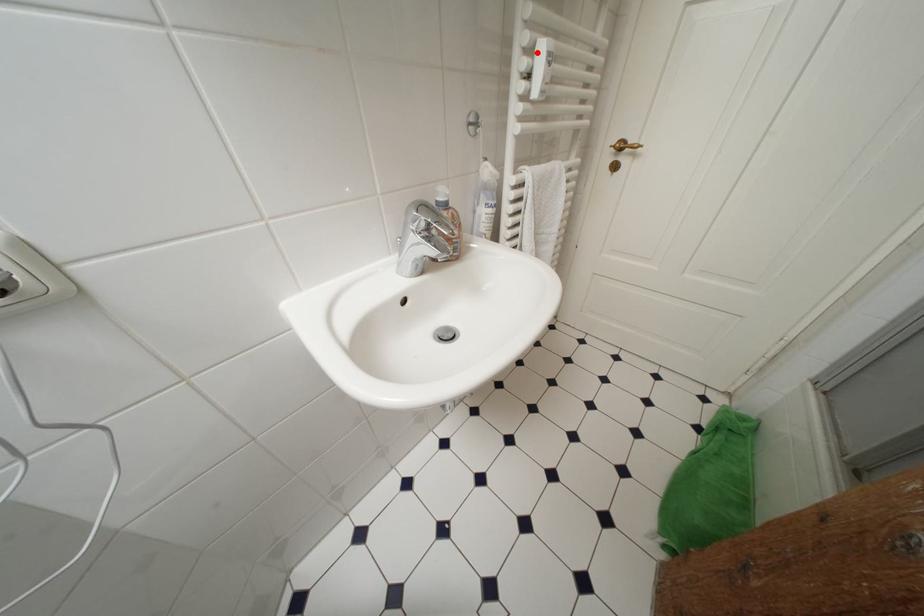
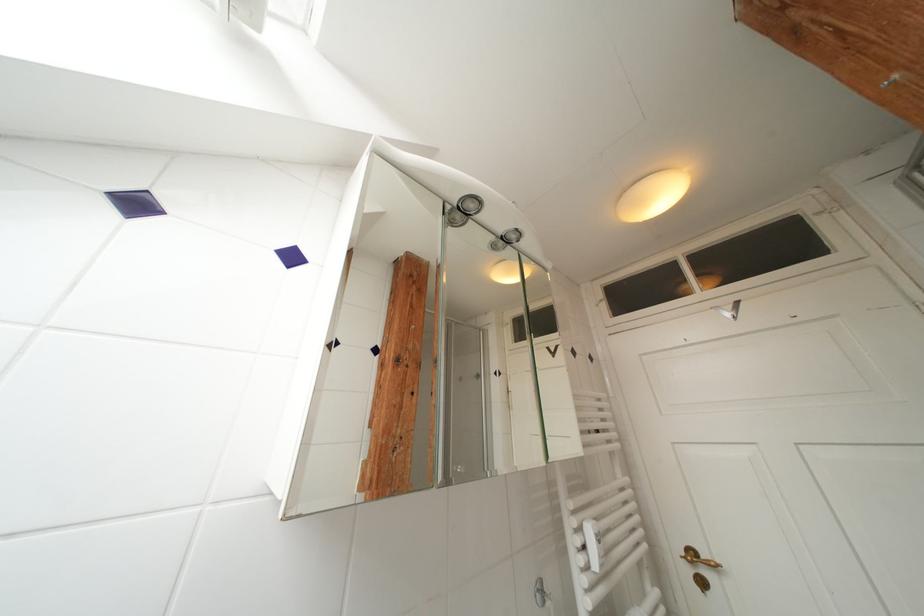
Find the pixel in the second image that matches the highlighted location in the first image.

(586, 533)